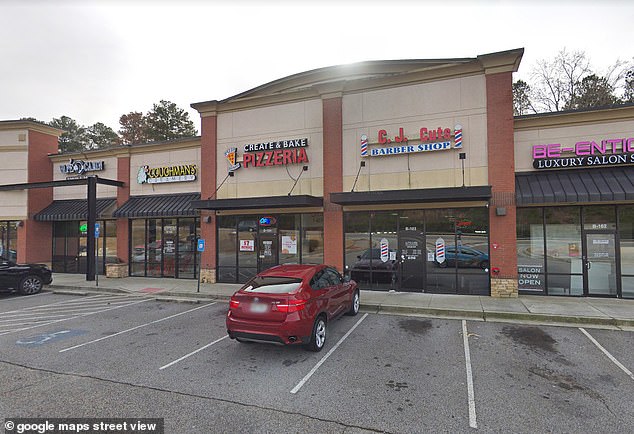
This screenshot has width=634, height=434. I want to click on doors, so click(165, 249), click(82, 244), click(408, 263), click(598, 274).